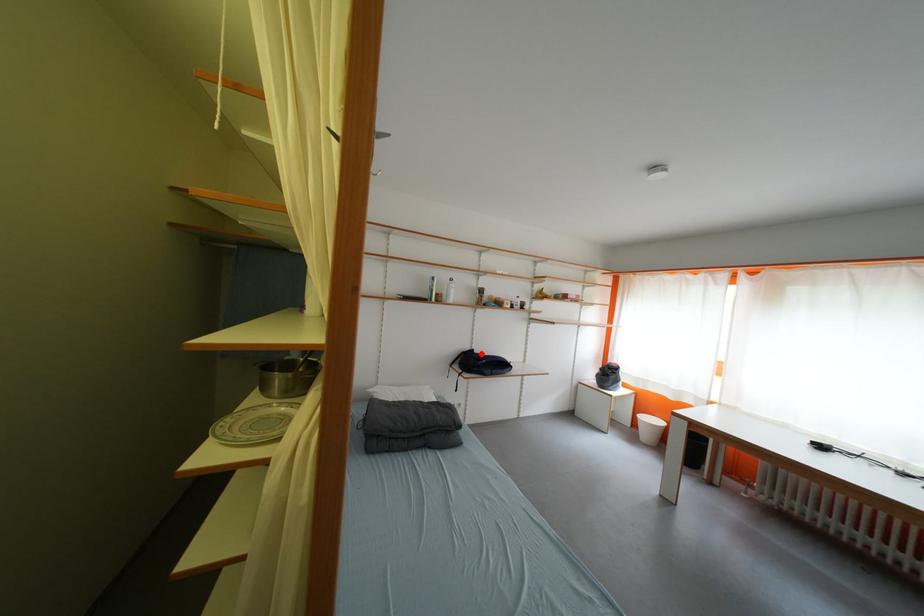
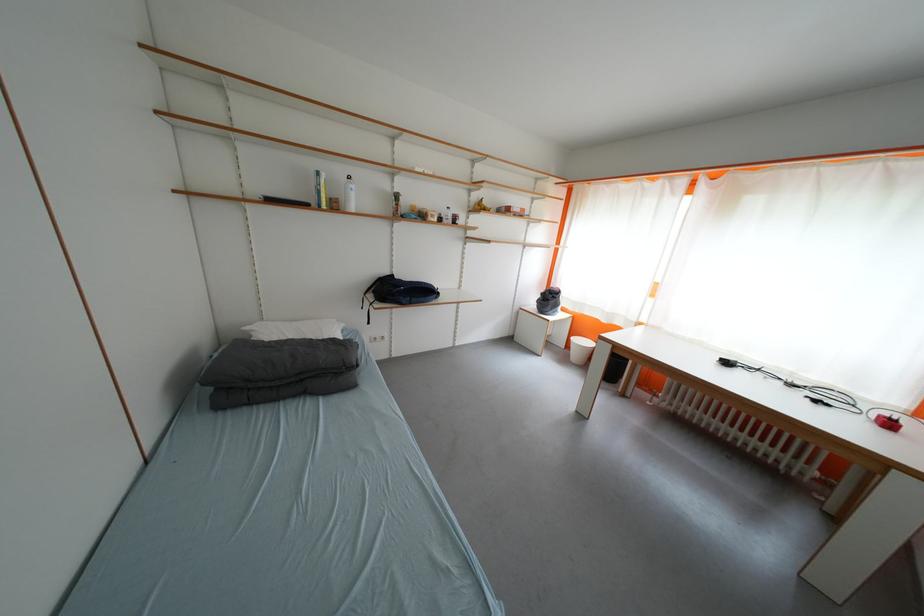
Question: I am providing you with two images of the same scene from different viewpoints. In image1, a red point is highlighted. Considering the same 3D point in image2, which of the following is correct?

Choices:
 (A) It is closer
 (B) It is farther

Answer: (A)